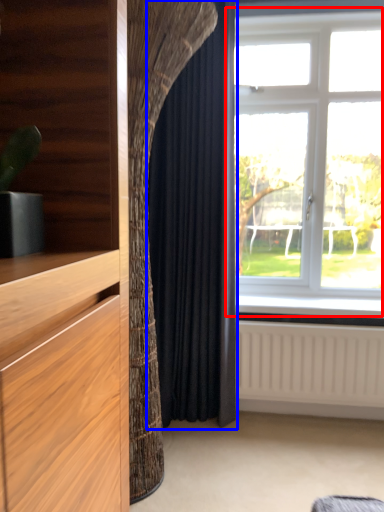
Question: Which of the following is the closest to the observer, window (highlighted by a red box) or curtain (highlighted by a blue box)?

Choices:
 (A) window
 (B) curtain

Answer: (B)